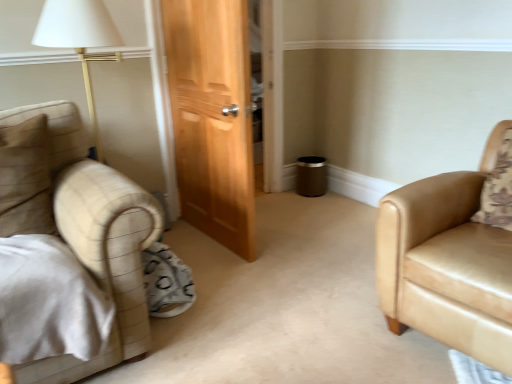
Question: Is point (30, 152) closer or farther from the camera than point (397, 220)?

Choices:
 (A) farther
 (B) closer

Answer: (A)

Question: Would you say beige fabric pillow at left is to the left or to the right of tan leather armchair at right in the picture?

Choices:
 (A) left
 (B) right

Answer: (A)

Question: Is beige fabric pillow at left bigger or smaller than tan leather armchair at right?

Choices:
 (A) big
 (B) small

Answer: (B)

Question: Is tan leather armchair at right bigger or smaller than beige fabric pillow at left?

Choices:
 (A) big
 (B) small

Answer: (A)

Question: Based on their positions, is tan leather armchair at right located to the left or right of beige fabric pillow at left?

Choices:
 (A) left
 (B) right

Answer: (B)

Question: From the image's perspective, is tan leather armchair at right above or below beige fabric pillow at left?

Choices:
 (A) above
 (B) below

Answer: (B)

Question: Is tan leather armchair at right inside or outside of beige fabric pillow at left?

Choices:
 (A) inside
 (B) outside

Answer: (B)